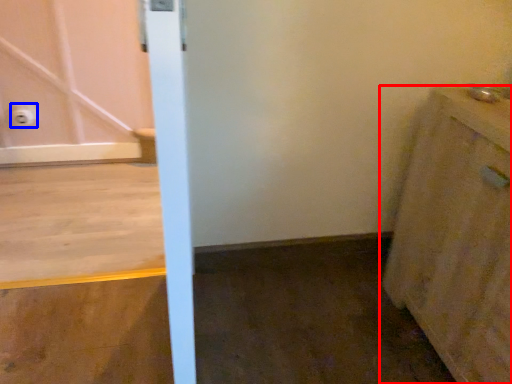
Question: Which object appears farthest to the camera in this image, cabinetry (highlighted by a red box) or electric outlet (highlighted by a blue box)?

Choices:
 (A) cabinetry
 (B) electric outlet

Answer: (B)